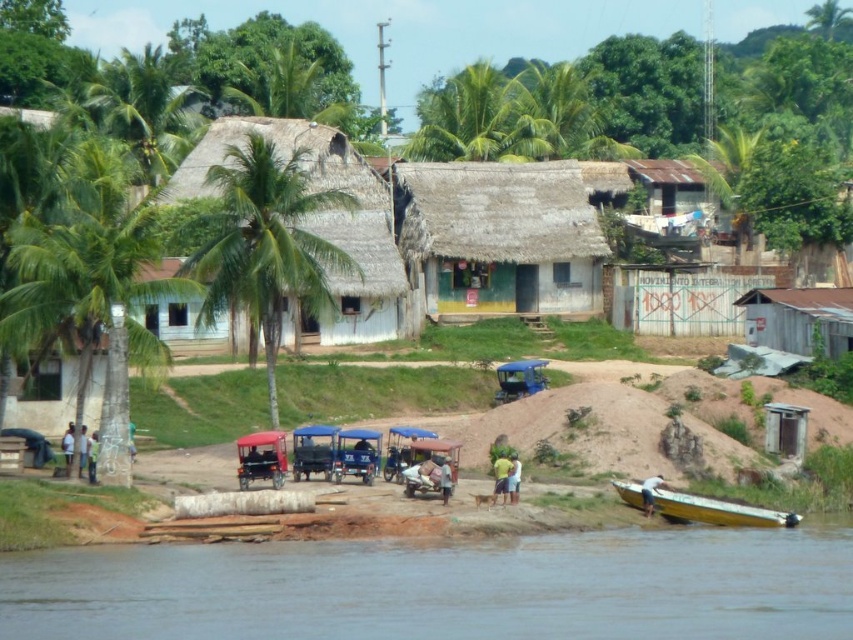
You are standing at the riverside and want to reach the yellow fabric shirt at center. There is a yellow matte boat at lower right in your way. Can you walk directly to the shirt without going around the boat?

The yellow matte boat at lower right is closer to the viewer than the yellow fabric shirt at center, so the boat is blocking your path. You would need to go around it to reach the shirt.

From the picture: You are standing at the riverside and see the yellow matte boat at lower right and the yellow fabric shirt at center. Which object is closer to the water surface?

The yellow matte boat at lower right is positioned under the yellow fabric shirt at center, so the boat is closer to the water surface than the shirt.

You are a traveler carrying a backpack and need to cross the river. You see a light blue shirt at center and a green fabric shirt at lower center. How far apart are these two shirts?

The light blue shirt at center and green fabric shirt at lower center are 6.79 feet apart from each other.